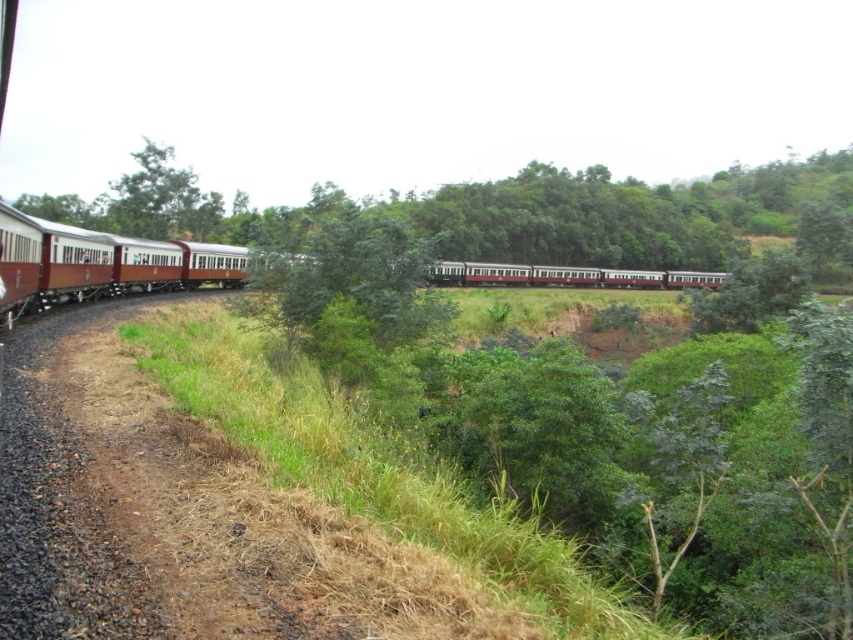
Can you confirm if matte red train at center is positioned to the right of green leafy tree at upper left?

Correct, you'll find matte red train at center to the right of green leafy tree at upper left.

Is point (196, 264) less distant than point (167, 214)?

That is True.

Is point (450, 284) farther from camera compared to point (141, 164)?

Yes, point (450, 284) is farther from viewer.

At what (x,y) coordinates should I click in order to perform the action: click on matte red train at center. Please return your answer as a coordinate pair (x, y). Looking at the image, I should click on (566, 275).